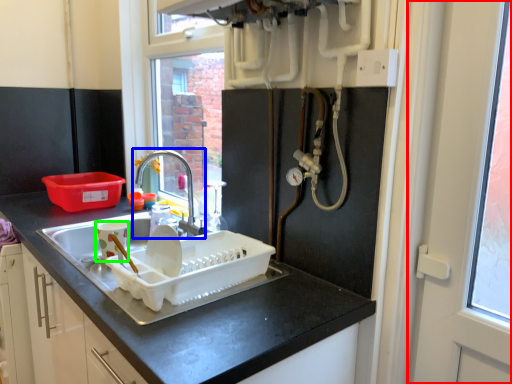
Question: Which is nearer to the screen door (highlighted by a red box)? tap (highlighted by a blue box) or appliance (highlighted by a green box).

Choices:
 (A) tap
 (B) appliance

Answer: (B)